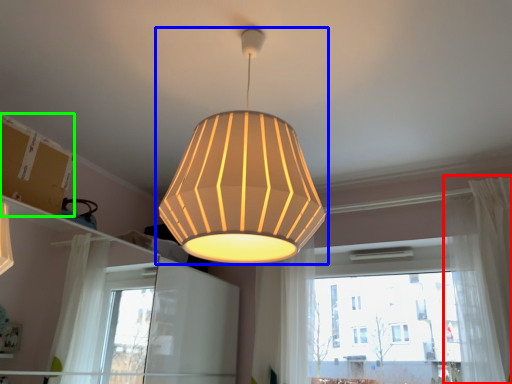
Question: Which is nearer to the curtain (highlighted by a red box)? lamp (highlighted by a blue box) or cardboard box (highlighted by a green box).

Choices:
 (A) lamp
 (B) cardboard box

Answer: (A)